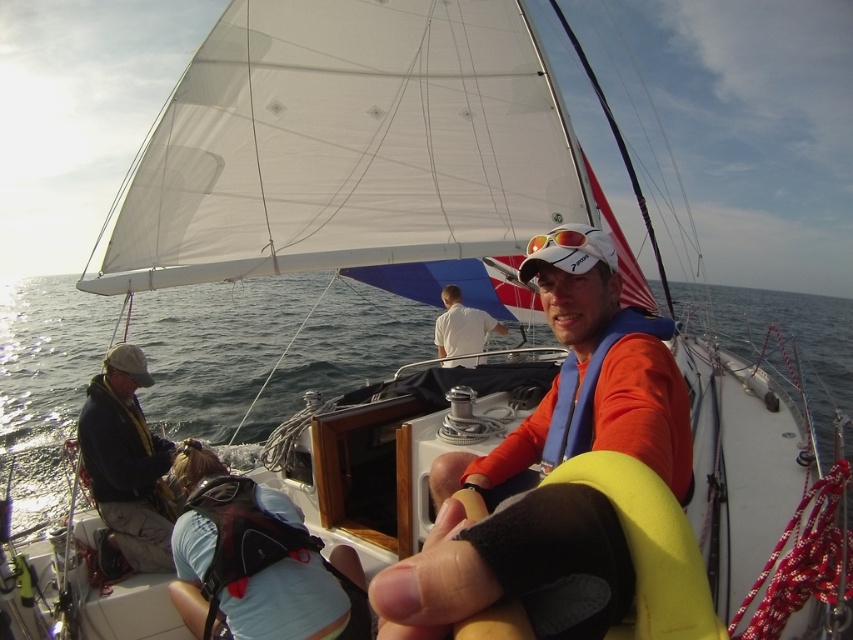
What do you see at coordinates (257, 563) in the screenshot? The height and width of the screenshot is (640, 853). I see `light blue fabric at lower center` at bounding box center [257, 563].

Does light blue fabric at lower center appear over dark blue fabric jacket at left?

Incorrect, light blue fabric at lower center is not positioned above dark blue fabric jacket at left.

Where is `light blue fabric at lower center`? The height and width of the screenshot is (640, 853). light blue fabric at lower center is located at coordinates (257, 563).

Which is below, dark blue fabric jacket at left or white cotton shirt at center?

Positioned lower is dark blue fabric jacket at left.

Where is `dark blue fabric jacket at left`? dark blue fabric jacket at left is located at coordinates (126, 464).

What are the coordinates of `light blue fabric at lower center` in the screenshot? It's located at (257, 563).

Is point (213, 548) in front of point (503, 324)?

That is True.

Find the location of `light blue fabric at lower center`. light blue fabric at lower center is located at coordinates (257, 563).